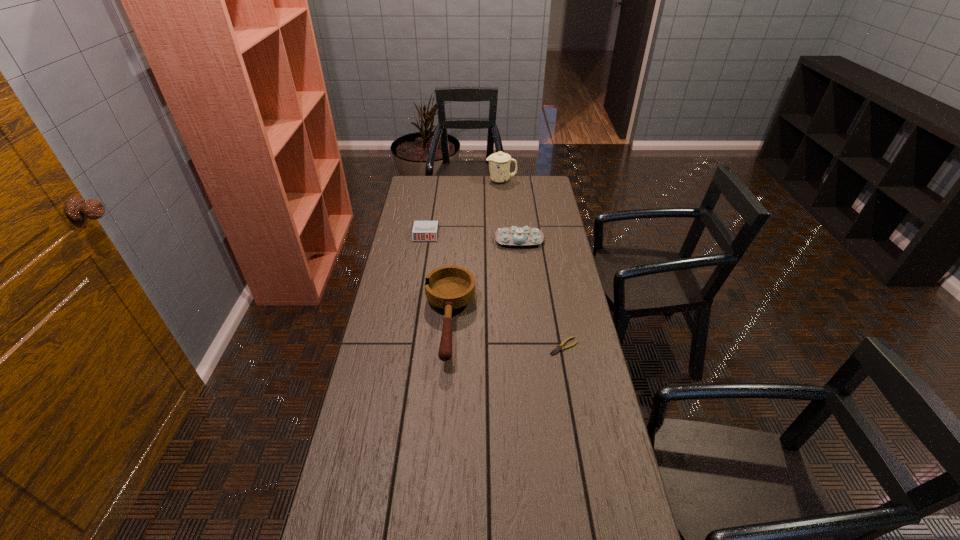
At what (x,y) coordinates should I click in order to perform the action: click on the tallest object. Please return your answer as a coordinate pair (x, y). This screenshot has width=960, height=540. Looking at the image, I should click on (499, 163).

This screenshot has height=540, width=960. I want to click on the farther chinaware, so click(499, 163).

The width and height of the screenshot is (960, 540). I want to click on saucepan, so click(450, 287).

Locate an element on the screen. The width and height of the screenshot is (960, 540). the shorter chinaware is located at coordinates (516, 236).

Find the location of a particular element. Image resolution: width=960 pixels, height=540 pixels. the fourth tallest object is located at coordinates (422, 230).

Where is `pliers`? Image resolution: width=960 pixels, height=540 pixels. pliers is located at coordinates (559, 347).

The height and width of the screenshot is (540, 960). Find the location of `vacant area situated on the spout of the farthest object`. vacant area situated on the spout of the farthest object is located at coordinates (437, 180).

This screenshot has height=540, width=960. Identify the location of free space located 0.270m on the spout of the farthest object. (437, 180).

Where is `free location located on the spout of the farthest object`? This screenshot has height=540, width=960. free location located on the spout of the farthest object is located at coordinates (453, 180).

Where is `vacant space located with the handle on the side of the saucepan`? The image size is (960, 540). vacant space located with the handle on the side of the saucepan is located at coordinates click(x=442, y=430).